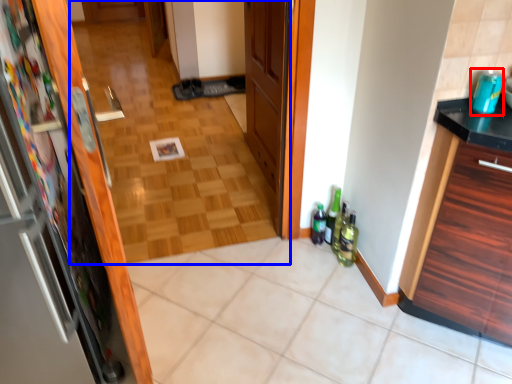
Question: Which point is further to the camera, beverage (highlighted by a red box) or corridor (highlighted by a blue box)?

Choices:
 (A) beverage
 (B) corridor

Answer: (B)